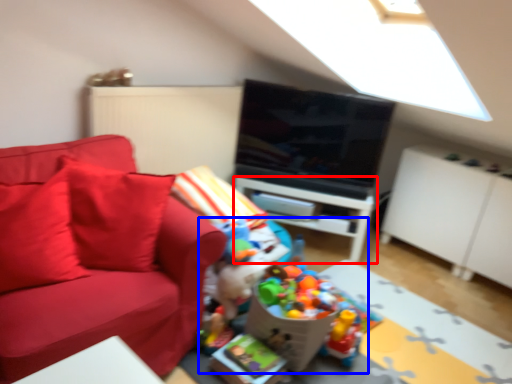
Question: Among these objects, which one is farthest to the camera, table (highlighted by a red box) or toy (highlighted by a blue box)?

Choices:
 (A) table
 (B) toy

Answer: (A)